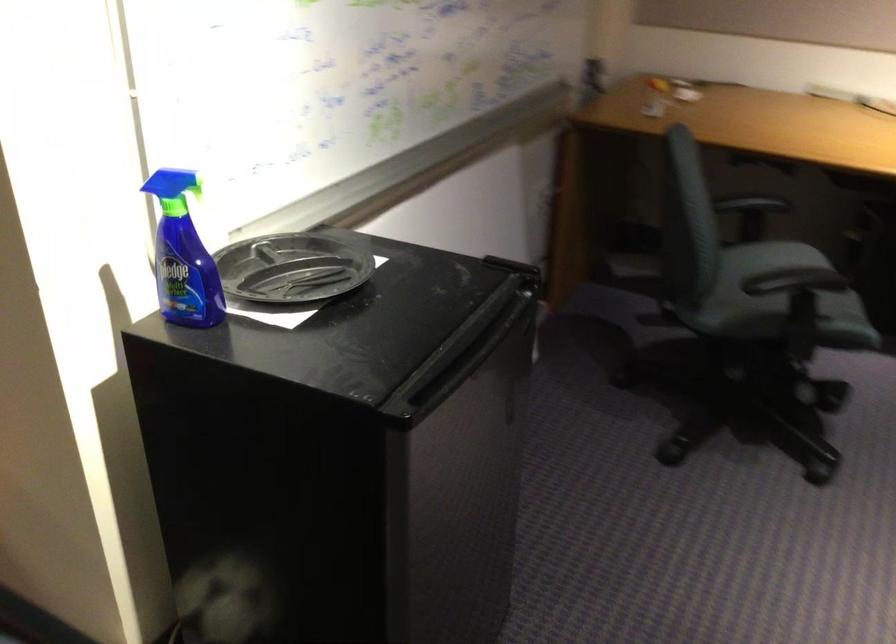
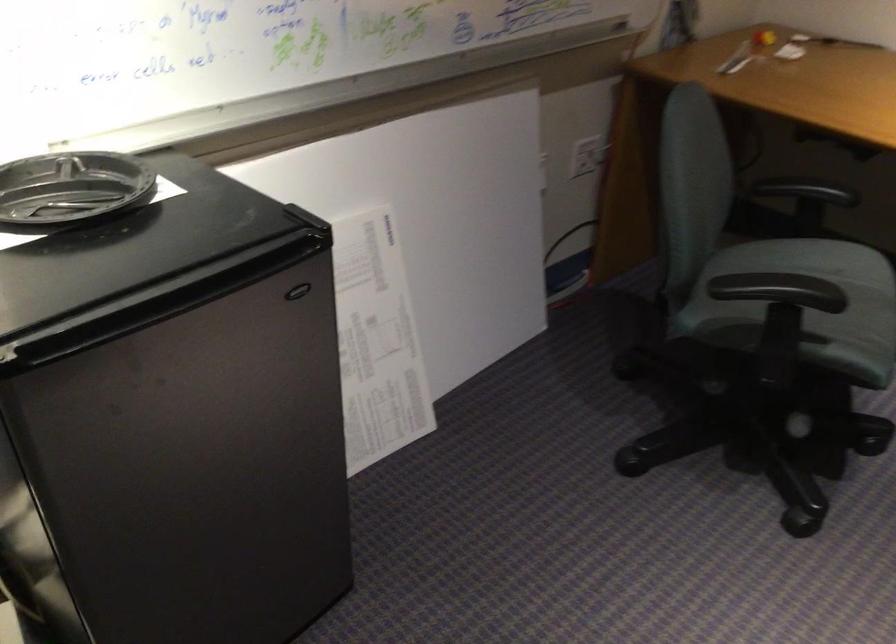
In a continuous first-person perspective shot, in which direction is the camera moving?

The cameraman moved toward right, forward.